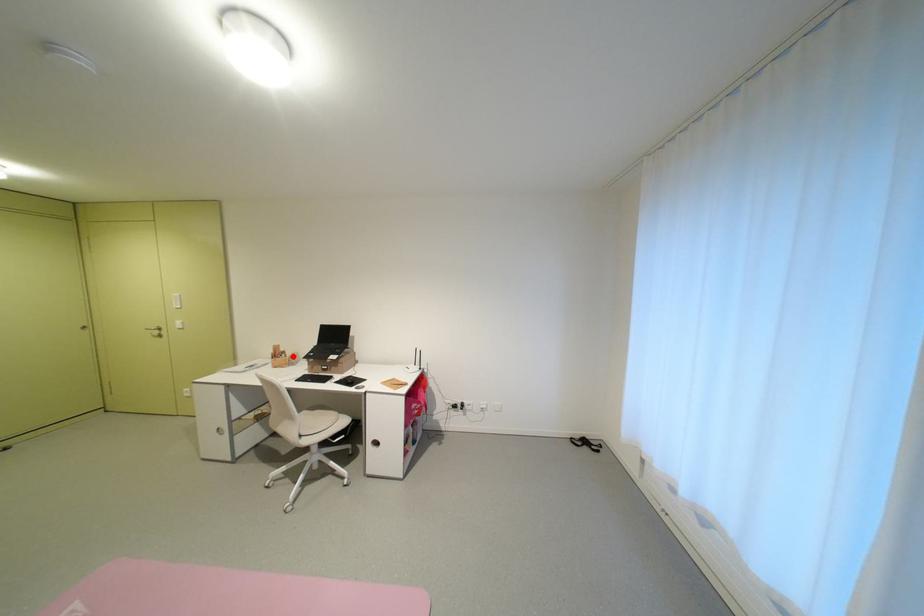
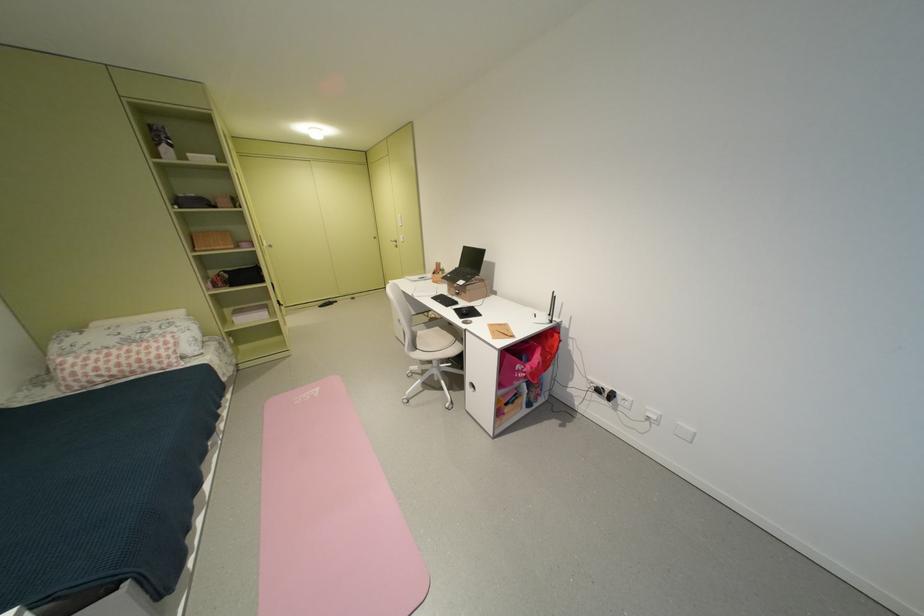
Where in the second image is the point corresponding to the highlighted location from the first image?

(450, 274)